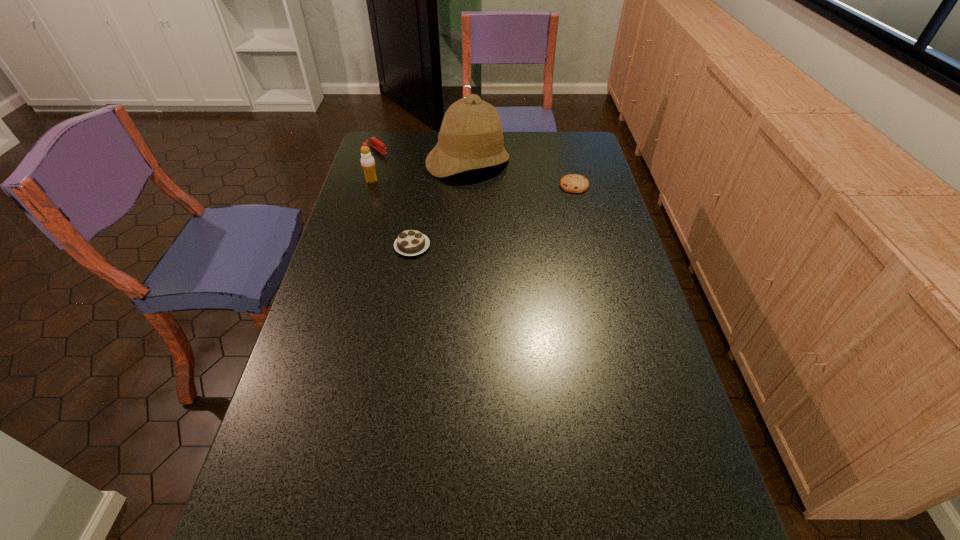
Where is `icecream present at the left edge`? This screenshot has height=540, width=960. icecream present at the left edge is located at coordinates (367, 161).

Find the location of `object located in the right edge section of the desktop`. object located in the right edge section of the desktop is located at coordinates (573, 183).

At what (x,y) coordinates should I click in order to perform the action: click on object that is at the far left corner. Please return your answer as a coordinate pair (x, y). Looking at the image, I should click on (373, 141).

The height and width of the screenshot is (540, 960). What are the coordinates of `free space at the far edge of the desktop` in the screenshot? It's located at (547, 131).

Where is `free point at the left edge`? The image size is (960, 540). free point at the left edge is located at coordinates (310, 421).

Image resolution: width=960 pixels, height=540 pixels. In order to click on blank space at the right edge of the desktop in this screenshot , I will do `click(619, 257)`.

This screenshot has width=960, height=540. Find the location of `vacant area at the far right corner`. vacant area at the far right corner is located at coordinates (575, 143).

I want to click on free point between the fourth shortest object and the chocolate cake, so click(x=392, y=213).

Locate an element on the screen. vacant space that's between the stapler and the chocolate cake is located at coordinates (396, 198).

At what (x,y) coordinates should I click in order to perform the action: click on empty location between the tallest object and the icecream. Please return your answer as a coordinate pair (x, y). Image resolution: width=960 pixels, height=540 pixels. Looking at the image, I should click on (420, 172).